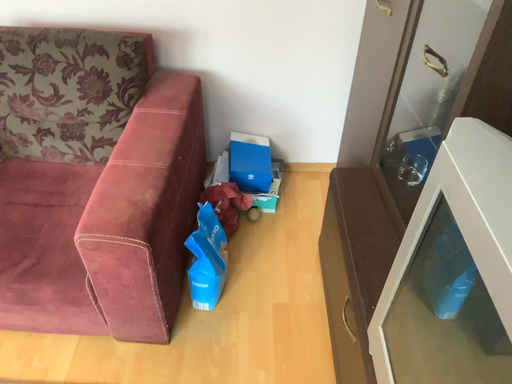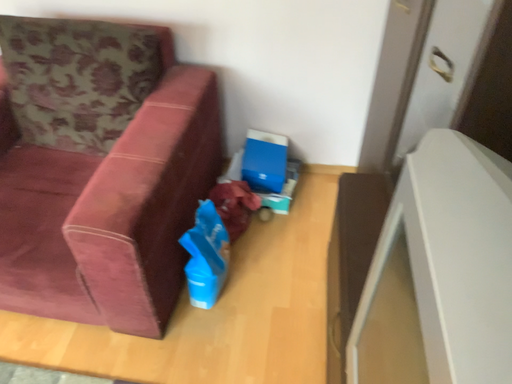
Question: How did the camera likely rotate when shooting the video?

Choices:
 (A) rotated left
 (B) rotated right

Answer: (A)